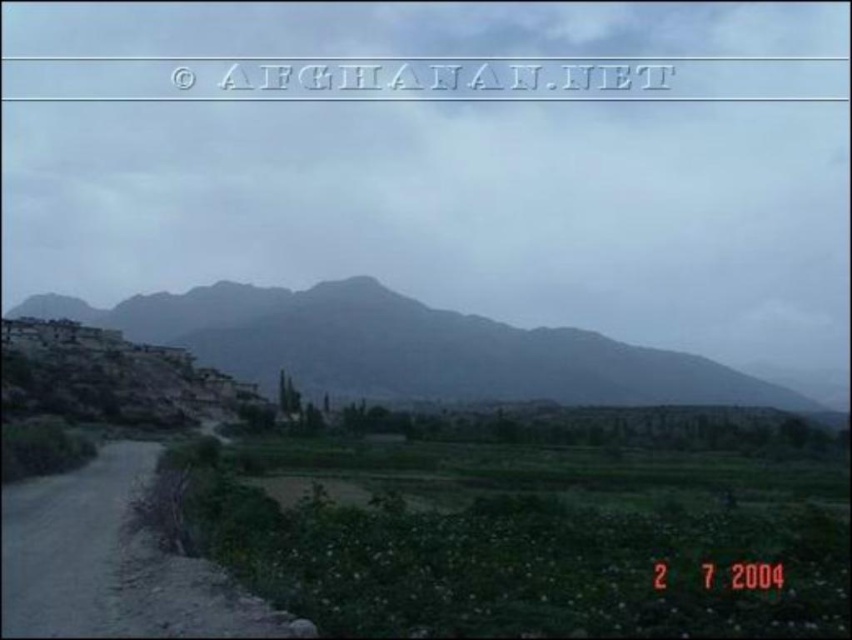
Question: Which of the following is the closest to the observer?

Choices:
 (A) dark gray rock at center
 (B) dirt road at lower left

Answer: (B)

Question: Does dark gray rock at center come in front of dirt road at lower left?

Choices:
 (A) yes
 (B) no

Answer: (B)

Question: Is the position of dark gray rock at center more distant than that of dirt road at lower left?

Choices:
 (A) no
 (B) yes

Answer: (B)

Question: Is dark gray rock at center closer to camera compared to dirt road at lower left?

Choices:
 (A) no
 (B) yes

Answer: (A)

Question: Which of the following is the closest to the observer?

Choices:
 (A) (666, 380)
 (B) (131, 561)

Answer: (B)